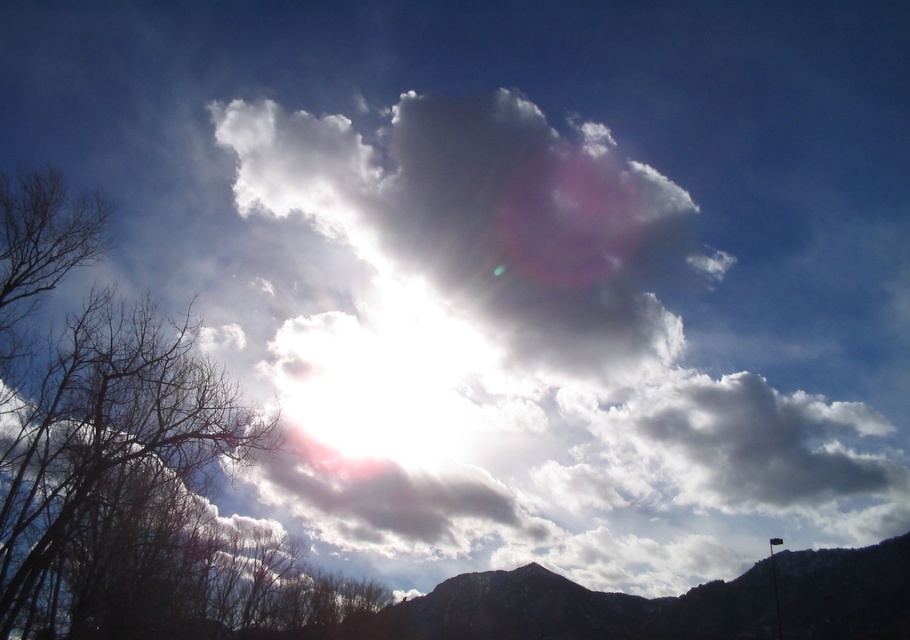
Does bare branches at left appear under dark gray rocky mountain at lower center?

Incorrect, bare branches at left is not positioned below dark gray rocky mountain at lower center.

Who is shorter, bare branches at left or dark gray rocky mountain at lower center?

dark gray rocky mountain at lower center

Between point (221, 625) and point (442, 593), which one is positioned in front?

Point (221, 625) is more forward.

This screenshot has width=910, height=640. What are the coordinates of `bare branches at left` in the screenshot? It's located at (125, 460).